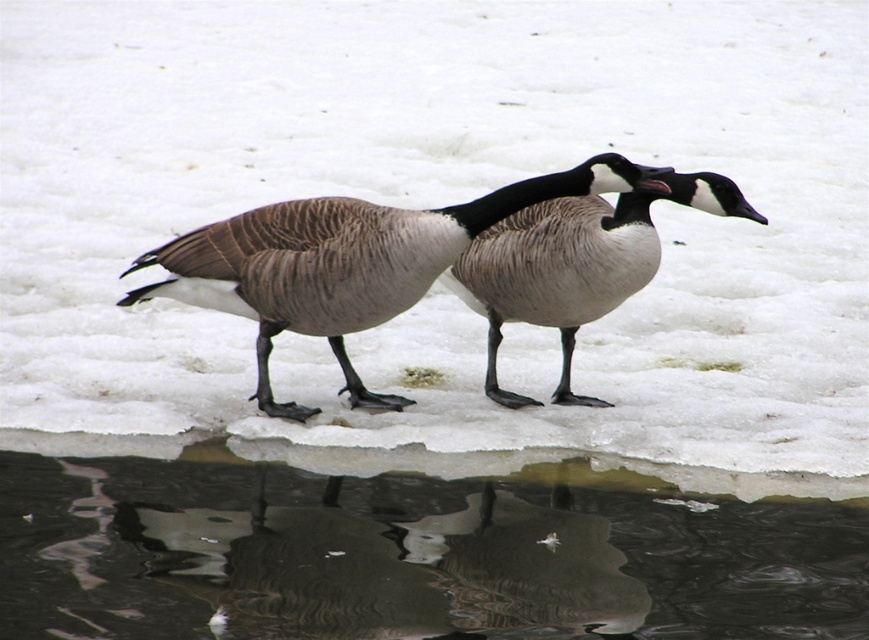
Does brown feathered goose at center have a greater width compared to brown speckled goose at center?

Yes.

Does brown feathered goose at center have a lesser height compared to brown speckled goose at center?

No.

The width and height of the screenshot is (869, 640). In order to click on brown feathered goose at center in this screenshot , I will do `click(346, 262)`.

What do you see at coordinates (410, 556) in the screenshot? This screenshot has width=869, height=640. I see `transparent ice at lower center` at bounding box center [410, 556].

Does transparent ice at lower center have a larger size compared to brown feathered goose at center?

No, transparent ice at lower center is not bigger than brown feathered goose at center.

Find the location of a particular element. transparent ice at lower center is located at coordinates (410, 556).

Between transparent ice at lower center and brown speckled goose at center, which one appears on the right side from the viewer's perspective?

Positioned to the right is brown speckled goose at center.

Where is `transparent ice at lower center`? transparent ice at lower center is located at coordinates (410, 556).

Between point (396, 547) and point (494, 321), which one is positioned behind?

Positioned behind is point (494, 321).

This screenshot has width=869, height=640. In order to click on transparent ice at lower center in this screenshot , I will do `click(410, 556)`.